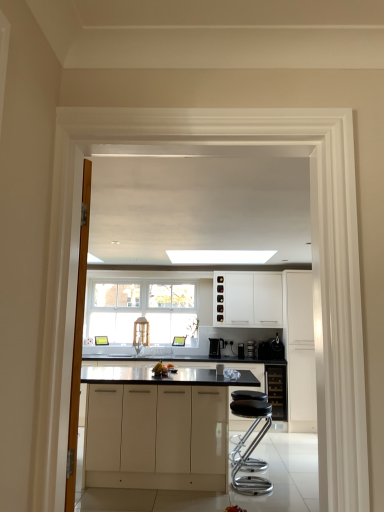
Question: Considering the relative sizes of satin silver toaster at center, arranged as the 1th appliance when viewed from the left, and black plastic coffee maker at right, which is the first appliance in right-to-left order, in the image provided, is satin silver toaster at center, arranged as the 1th appliance when viewed from the left, taller than black plastic coffee maker at right, which is the first appliance in right-to-left order,?

Choices:
 (A) yes
 (B) no

Answer: (B)

Question: Is satin silver toaster at center, arranged as the 1th appliance when viewed from the left, further to the viewer compared to black plastic coffee maker at right, marked as the third appliance in a left-to-right arrangement?

Choices:
 (A) yes
 (B) no

Answer: (A)

Question: Can you confirm if satin silver toaster at center, arranged as the 1th appliance when viewed from the left, is wider than black plastic coffee maker at right, which is the first appliance in right-to-left order?

Choices:
 (A) no
 (B) yes

Answer: (A)

Question: Considering the relative positions of satin silver toaster at center, arranged as the 1th appliance when viewed from the left, and black plastic coffee maker at right, marked as the third appliance in a left-to-right arrangement, in the image provided, is satin silver toaster at center, arranged as the 1th appliance when viewed from the left, to the right of black plastic coffee maker at right, marked as the third appliance in a left-to-right arrangement, from the viewer's perspective?

Choices:
 (A) no
 (B) yes

Answer: (A)

Question: Is satin silver toaster at center, arranged as the 1th appliance when viewed from the left, not near black plastic coffee maker at right, marked as the third appliance in a left-to-right arrangement?

Choices:
 (A) no
 (B) yes

Answer: (A)

Question: Is satin silver toaster at center, placed as the third appliance when sorted from right to left, outside black plastic coffee maker at right, which is the first appliance in right-to-left order?

Choices:
 (A) yes
 (B) no

Answer: (A)

Question: Is white matte cabinet at right, placed as the 4th cabinetry when sorted from left to right, at the back of white matte cabinetry at center, positioned as the 1th cabinetry in front-to-back order?

Choices:
 (A) yes
 (B) no

Answer: (B)

Question: Is white matte cabinetry at center, positioned as the 1th cabinetry in front-to-back order, taller than white matte cabinet at right, which is the 1th cabinetry in right-to-left order?

Choices:
 (A) yes
 (B) no

Answer: (B)

Question: Is white matte cabinetry at center, positioned as the 1th cabinetry in front-to-back order, wider than white matte cabinet at right, placed as the 4th cabinetry when sorted from left to right?

Choices:
 (A) no
 (B) yes

Answer: (B)

Question: Can you confirm if white matte cabinetry at center, the 1th cabinetry positioned from the left, is positioned to the left of white matte cabinet at right, positioned as the third cabinetry in back-to-front order?

Choices:
 (A) yes
 (B) no

Answer: (A)

Question: Considering the relative sizes of white matte cabinetry at center, positioned as the 1th cabinetry in front-to-back order, and white matte cabinet at right, which is the 1th cabinetry in right-to-left order, in the image provided, is white matte cabinetry at center, positioned as the 1th cabinetry in front-to-back order, thinner than white matte cabinet at right, which is the 1th cabinetry in right-to-left order,?

Choices:
 (A) yes
 (B) no

Answer: (B)

Question: Is white matte cabinetry at center, the fourth cabinetry from the right, smaller than white matte cabinet at right, placed as the 4th cabinetry when sorted from left to right?

Choices:
 (A) yes
 (B) no

Answer: (B)

Question: Can you confirm if white matte cabinet at center, the 1th cabinetry viewed from the back, is thinner than white matte cabinet at right, placed as the 4th cabinetry when sorted from left to right?

Choices:
 (A) no
 (B) yes

Answer: (B)